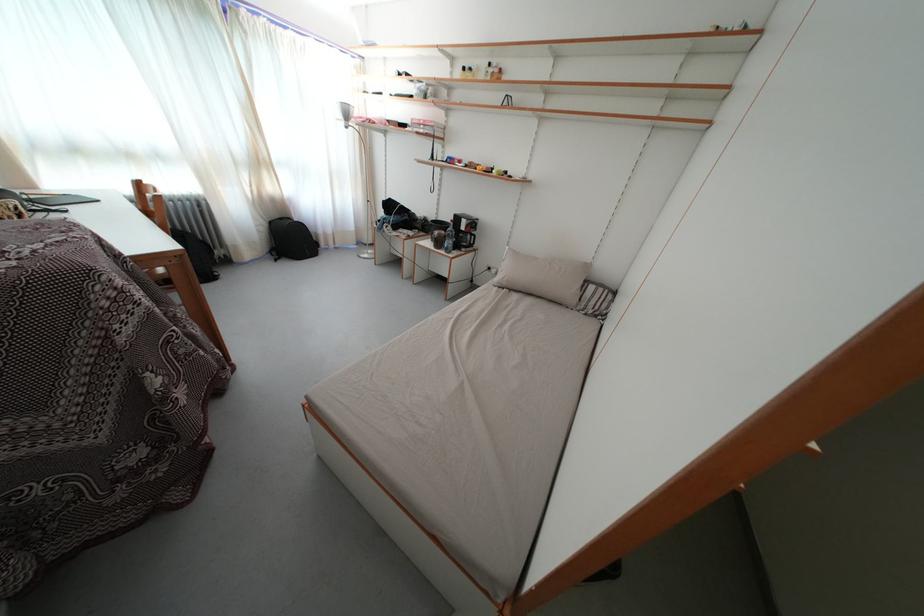
The height and width of the screenshot is (616, 924). What are the coordinates of `coffee pot handle` in the screenshot? It's located at (469, 233).